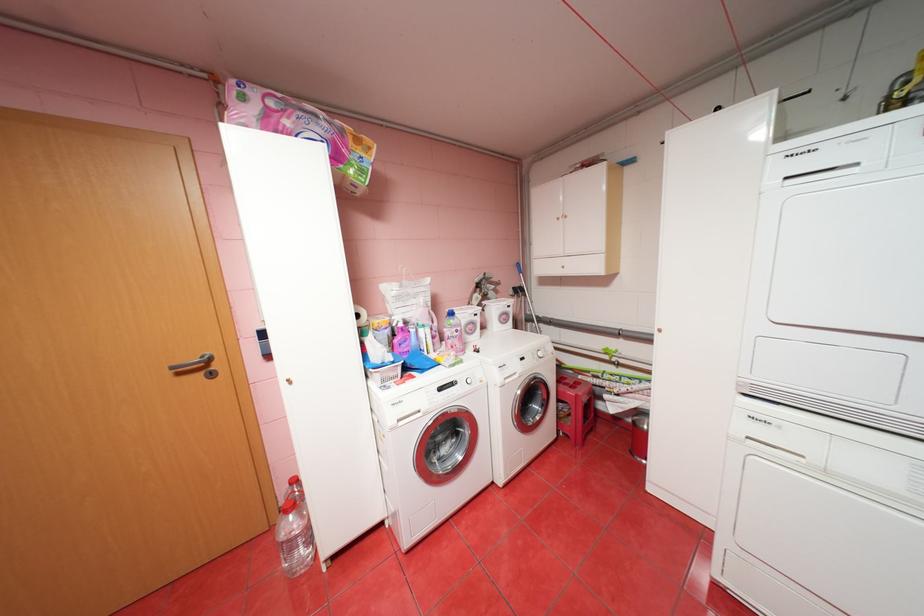
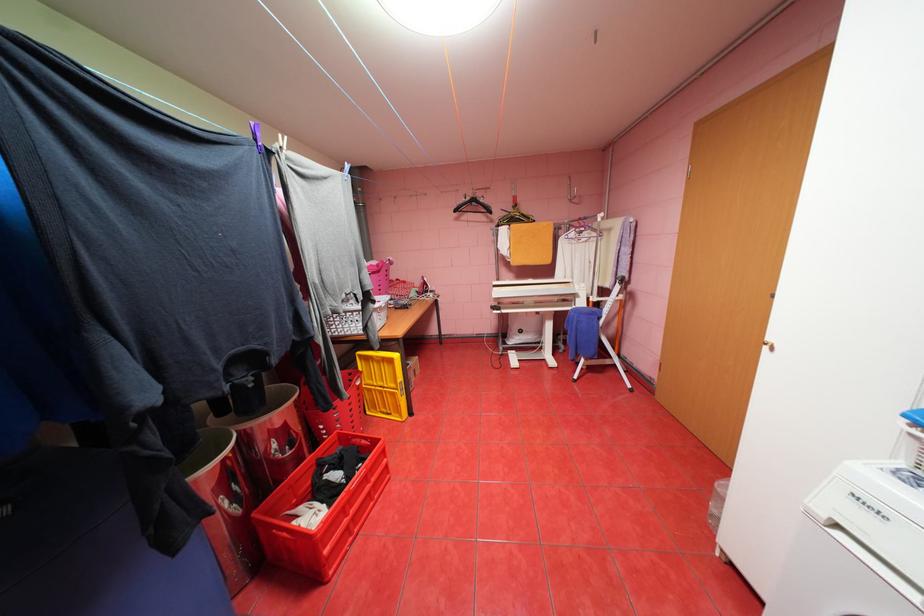
The point at (293, 384) is marked in the first image. Where is the corresponding point in the second image?

(774, 347)